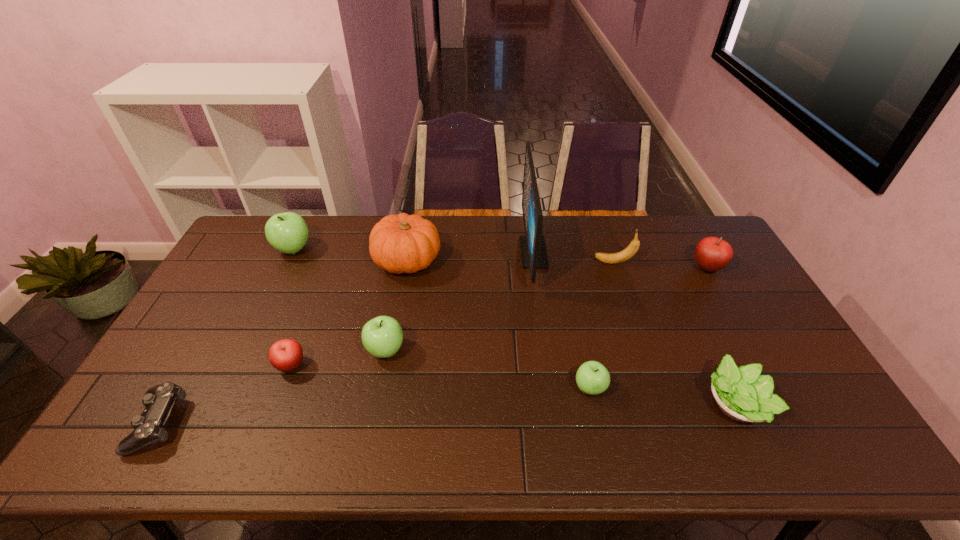
The height and width of the screenshot is (540, 960). Find the location of `vacant space that's between the farther red apple and the shortest object`. vacant space that's between the farther red apple and the shortest object is located at coordinates [x=432, y=346].

Identify the location of vacant space that's between the lettuce and the farther red apple. (721, 335).

Identify the location of free spot between the pumpkin and the tallest apple. This screenshot has width=960, height=540. (350, 255).

Image resolution: width=960 pixels, height=540 pixels. In order to click on unoccupied area between the farther red apple and the second farthest green apple in this screenshot , I will do `click(546, 309)`.

I want to click on vacant space that's between the right red apple and the second green apple from right to left, so click(x=546, y=309).

In order to click on free point between the tallest object and the third apple from left to right in this screenshot , I will do `click(460, 301)`.

At what (x,y) coordinates should I click in order to perform the action: click on free spot between the orange pumpkin and the nearest green apple. Please return your answer as a coordinate pair (x, y). This screenshot has width=960, height=540. Looking at the image, I should click on (499, 325).

The width and height of the screenshot is (960, 540). Identify the location of free space between the fourth apple from right to left and the pumpkin. (349, 313).

Find the location of a particular element. This screenshot has width=960, height=540. object that is the eighth closest to the second farthest green apple is located at coordinates (742, 394).

The height and width of the screenshot is (540, 960). What are the coordinates of `the eighth closest object to the fourth object from right to left` in the screenshot? It's located at (287, 232).